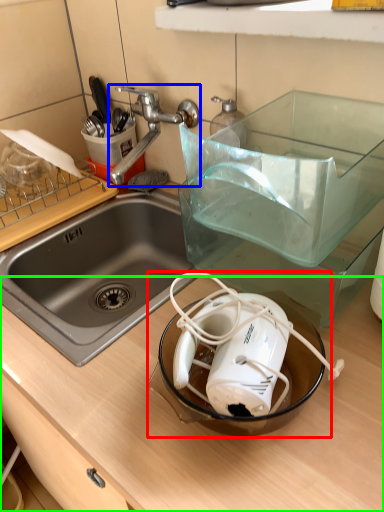
Question: Estimate the real-world distances between objects in this image. Which object is farther from appliance (highlighted by a red box), tap (highlighted by a blue box) or counter top (highlighted by a green box)?

Choices:
 (A) tap
 (B) counter top

Answer: (A)